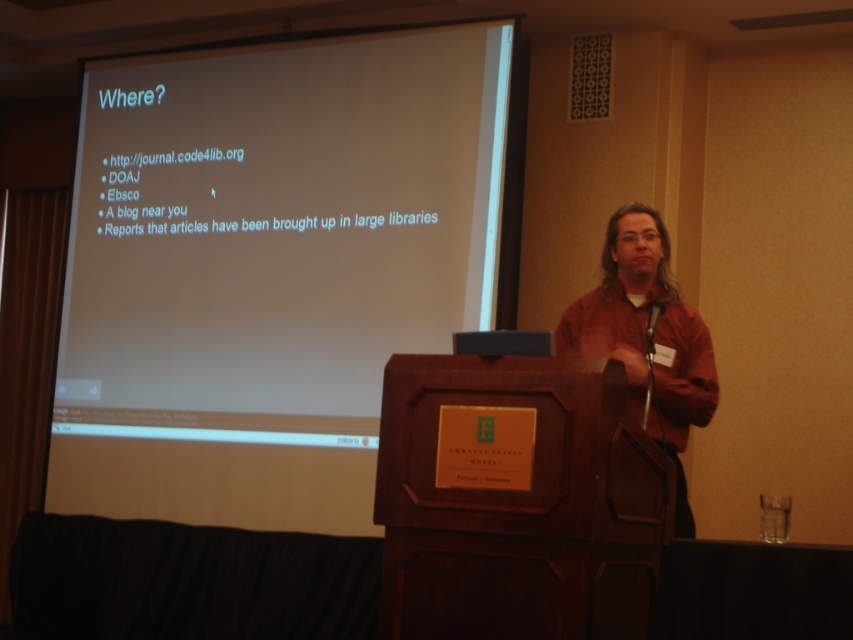
Which is more to the right, dark wood podium at center or brown leather jacket at right?

brown leather jacket at right

Is dark wood podium at center below brown leather jacket at right?

Indeed, dark wood podium at center is positioned under brown leather jacket at right.

Between point (554, 621) and point (695, 419), which one is positioned in front?

Point (554, 621)

Image resolution: width=853 pixels, height=640 pixels. I want to click on dark wood podium at center, so click(518, 502).

Does white matte projection screen at upper left appear over dark wood podium at center?

Indeed, white matte projection screen at upper left is positioned over dark wood podium at center.

Is point (248, 182) in front of point (500, 611)?

No, (248, 182) is behind (500, 611).

Image resolution: width=853 pixels, height=640 pixels. I want to click on white matte projection screen at upper left, so click(268, 268).

Can you confirm if white matte projection screen at upper left is bigger than brown leather jacket at right?

Yes.

Is white matte projection screen at upper left to the right of brown leather jacket at right from the viewer's perspective?

Incorrect, white matte projection screen at upper left is not on the right side of brown leather jacket at right.

Describe the element at coordinates (268, 268) in the screenshot. This screenshot has height=640, width=853. I see `white matte projection screen at upper left` at that location.

I want to click on white matte projection screen at upper left, so click(268, 268).